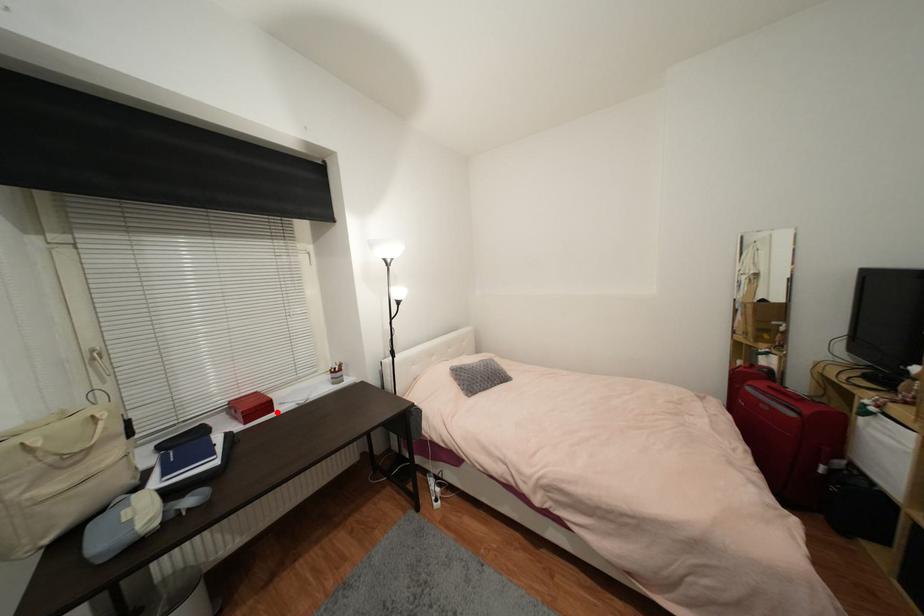
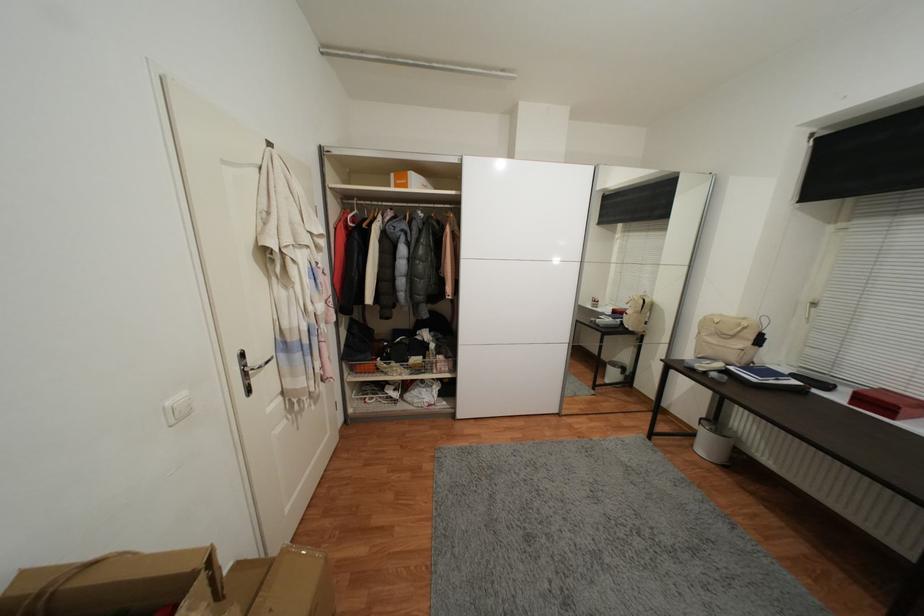
In the second image, find the point that corresponds to the highlighted location in the first image.

(897, 419)